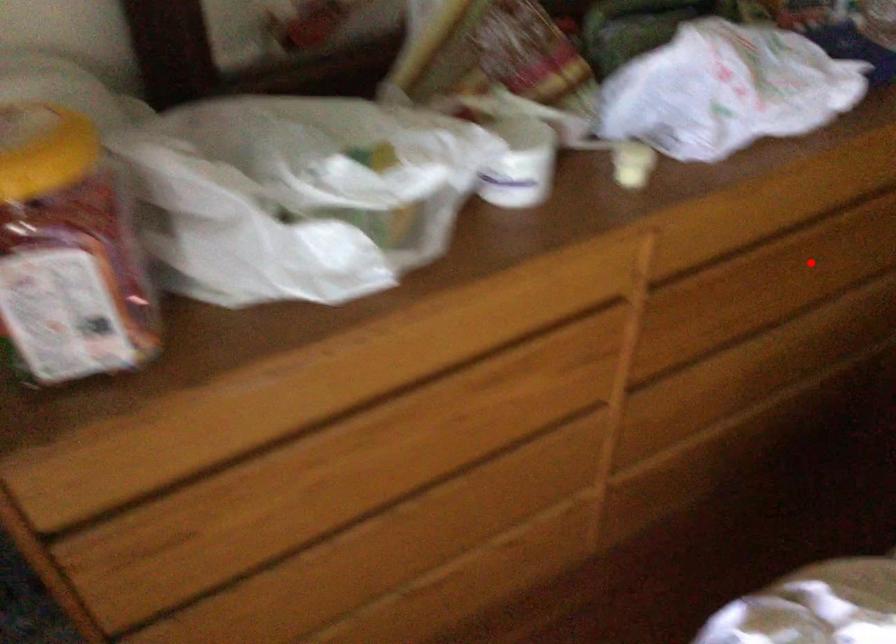
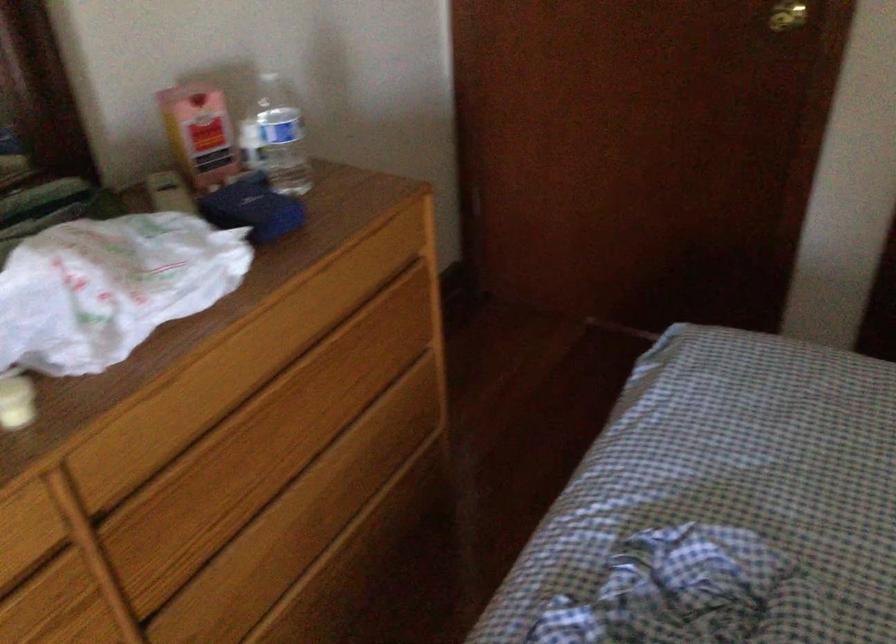
The point at the highlighted location is marked in the first image. Where is the corresponding point in the second image?

(291, 413)